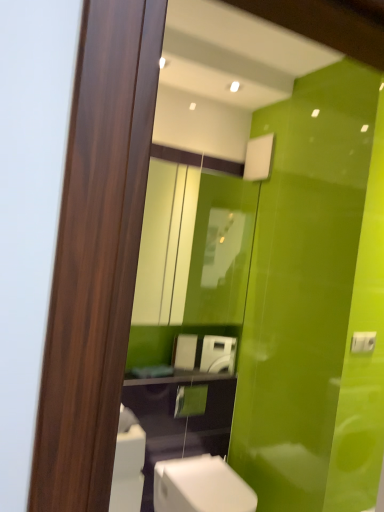
Question: Considering the relative positions of matte glass mirror at upper center and white glossy washing machine at center in the image provided, is matte glass mirror at upper center in front of white glossy washing machine at center?

Choices:
 (A) yes
 (B) no

Answer: (A)

Question: From a real-world perspective, is matte glass mirror at upper center on top of white glossy washing machine at center?

Choices:
 (A) no
 (B) yes

Answer: (B)

Question: Does matte glass mirror at upper center appear on the left side of white glossy washing machine at center?

Choices:
 (A) no
 (B) yes

Answer: (B)

Question: Can you confirm if matte glass mirror at upper center is smaller than white glossy washing machine at center?

Choices:
 (A) no
 (B) yes

Answer: (A)

Question: Considering the relative sizes of matte glass mirror at upper center and white glossy washing machine at center in the image provided, is matte glass mirror at upper center wider than white glossy washing machine at center?

Choices:
 (A) no
 (B) yes

Answer: (B)

Question: Based on their sizes in the image, would you say white glossy washing machine at center is bigger or smaller than white glossy toilet at lower center?

Choices:
 (A) big
 (B) small

Answer: (B)

Question: In the image, is white glossy washing machine at center positioned in front of or behind white glossy toilet at lower center?

Choices:
 (A) behind
 (B) front

Answer: (A)

Question: From the image's perspective, is white glossy washing machine at center located above or below white glossy toilet at lower center?

Choices:
 (A) below
 (B) above

Answer: (B)

Question: Is point (218, 343) positioned closer to the camera than point (162, 487)?

Choices:
 (A) closer
 (B) farther

Answer: (B)

Question: From a real-world perspective, is white glossy toilet at lower center positioned above or below matte glass mirror at upper center?

Choices:
 (A) above
 (B) below

Answer: (B)

Question: Is point (238, 489) closer or farther from the camera than point (168, 197)?

Choices:
 (A) closer
 (B) farther

Answer: (A)

Question: Considering the positions of white glossy toilet at lower center and matte glass mirror at upper center in the image, is white glossy toilet at lower center taller or shorter than matte glass mirror at upper center?

Choices:
 (A) tall
 (B) short

Answer: (B)

Question: Is white glossy toilet at lower center spatially inside matte glass mirror at upper center, or outside of it?

Choices:
 (A) inside
 (B) outside

Answer: (B)

Question: In terms of width, does matte glass mirror at upper center look wider or thinner when compared to white glossy toilet at lower center?

Choices:
 (A) thin
 (B) wide

Answer: (A)

Question: From the image's perspective, is matte glass mirror at upper center positioned above or below white glossy toilet at lower center?

Choices:
 (A) above
 (B) below

Answer: (A)